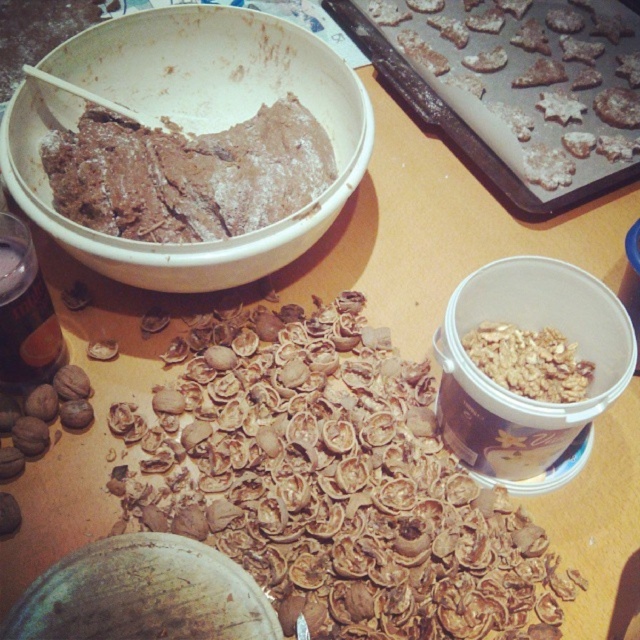
You are a baker preparing cookies and notice two items at the center of your workspace. You need to determine which one is higher. Which item is taller between the brown textured walnut shells at center and the chocolate dough at center?

The brown textured walnut shells at center is taller than the chocolate dough at center.